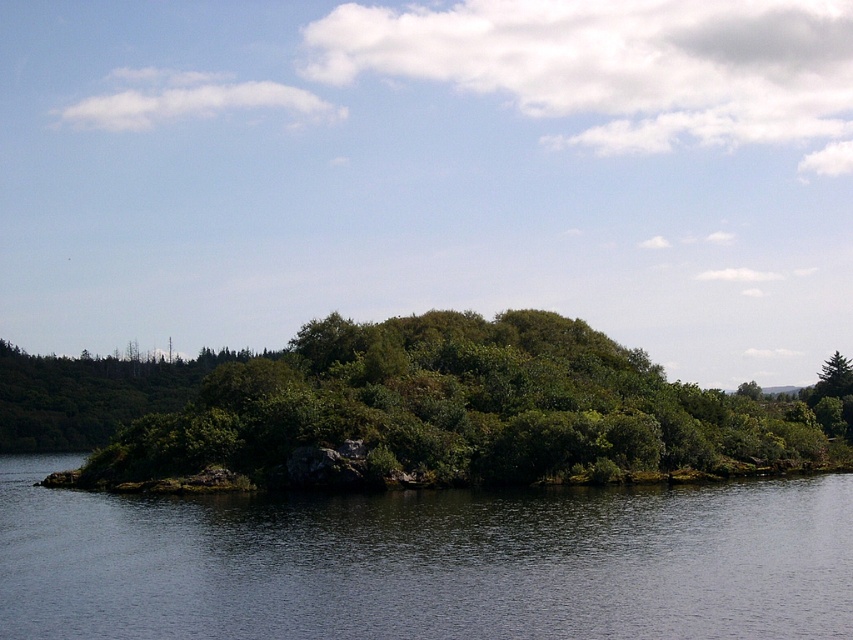
Question: Does transparent water at center have a larger size compared to green leafy bush at center?

Choices:
 (A) no
 (B) yes

Answer: (A)

Question: Which point appears farthest from the camera in this image?

Choices:
 (A) (672, 628)
 (B) (206, 416)

Answer: (B)

Question: Can you confirm if transparent water at center is positioned to the right of green leafy bush at center?

Choices:
 (A) yes
 (B) no

Answer: (B)

Question: Among these objects, which one is farthest from the camera?

Choices:
 (A) transparent water at center
 (B) green leafy bush at center

Answer: (B)

Question: Observing the image, what is the correct spatial positioning of transparent water at center in reference to green leafy bush at center?

Choices:
 (A) right
 (B) left

Answer: (B)

Question: Which point appears farthest from the camera in this image?

Choices:
 (A) (445, 451)
 (B) (102, 538)

Answer: (A)